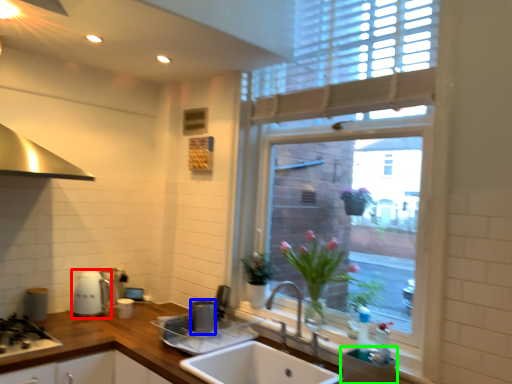
Question: Based on their relative distances, which object is nearer to appliance (highlighted by a red box)? Choose from appliance (highlighted by a blue box) and appliance (highlighted by a green box).

Choices:
 (A) appliance
 (B) appliance

Answer: (A)